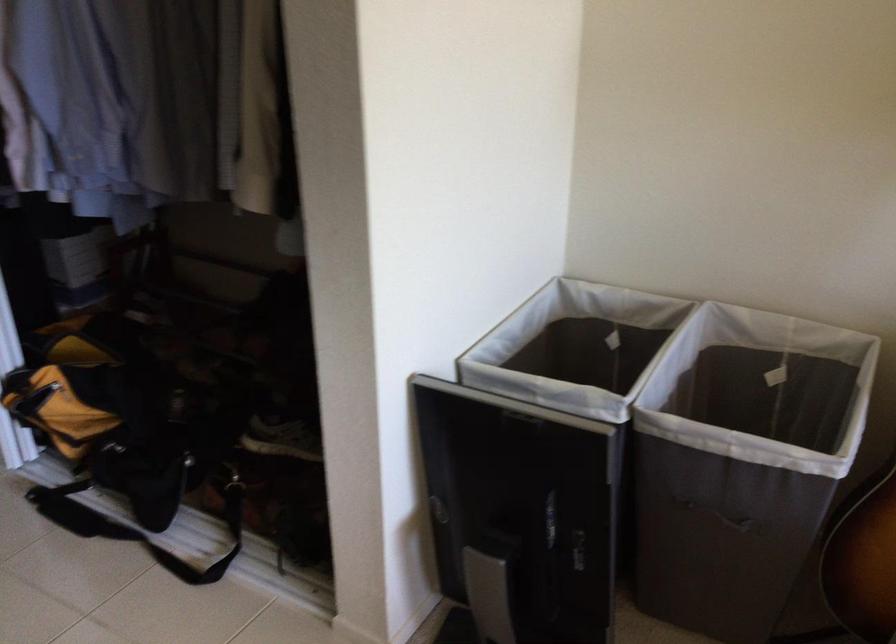
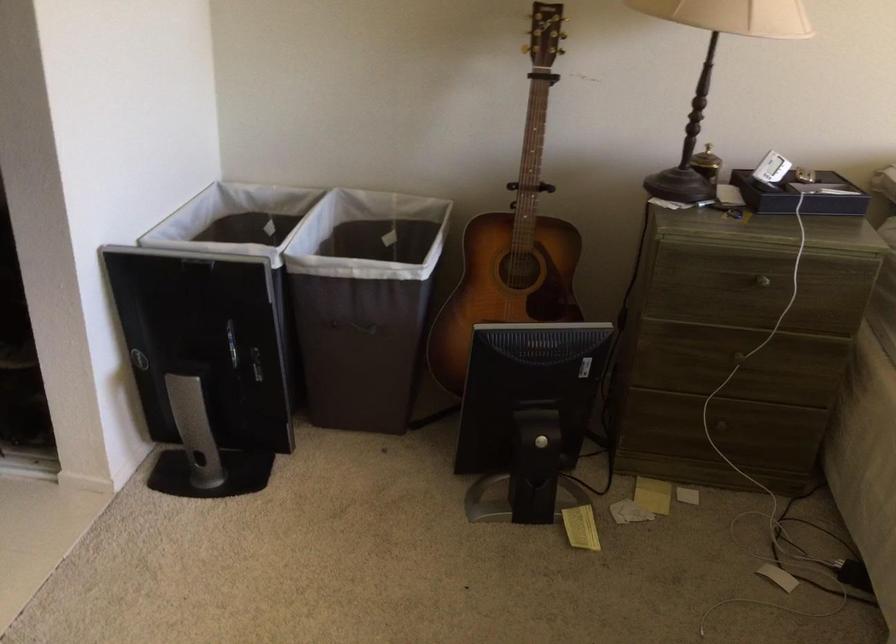
Question: In a continuous first-person perspective shot, in which direction is the camera moving?

Choices:
 (A) Left
 (B) Right
 (C) Forward
 (D) Backward

Answer: (D)